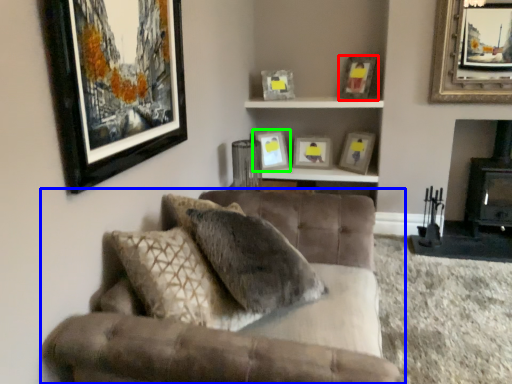
Question: Based on their relative distances, which object is farther from picture frame (highlighted by a red box)? Choose from studio couch (highlighted by a blue box) and picture frame (highlighted by a green box).

Choices:
 (A) studio couch
 (B) picture frame

Answer: (A)